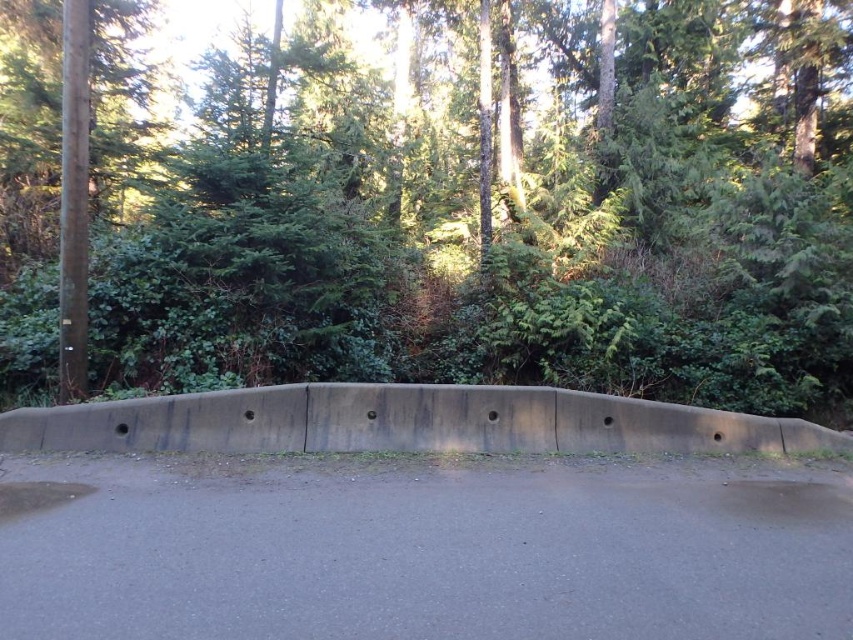
You are standing at point A, which is at the center of the curved concrete barrier with circular holes. You want to walk to point B, which is at the point marked by the coordinates point (762, 19). The path between them is 27.47 feet long. If your walking speed is 3 feet per second, how many seconds will it take you to reach point B from point A?

The distance between point A and point B is 27.47 feet. Since you walk at 3 feet per second, dividing the distance by the speed gives 27.47 divided by 3, which equals approximately 9.16 seconds. Therefore, it will take about 9.16 seconds to reach point B from point A.

Consider the image. You are a pedestrian standing on the gray concrete barrier at center. Looking ahead, where is the green leafy forest at upper center located relative to you?

The green leafy forest at upper center is above the gray concrete barrier at center, so it is located above you.

You are a landscape architect evaluating a proposed design for a new pedestrian walkway. The design includes a gray concrete barrier at center and a green leafy forest at upper center. Based on the image, which of these two elements occupies a larger area in the scene?

The green leafy forest at upper center is bigger than the gray concrete barrier at center, so it occupies a larger area in the scene.